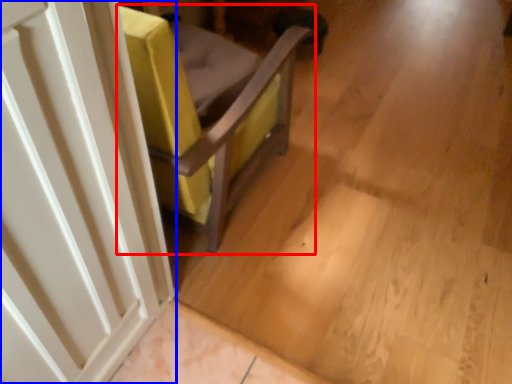
Question: Which point is closer to the camera, furniture (highlighted by a red box) or door (highlighted by a blue box)?

Choices:
 (A) furniture
 (B) door

Answer: (B)